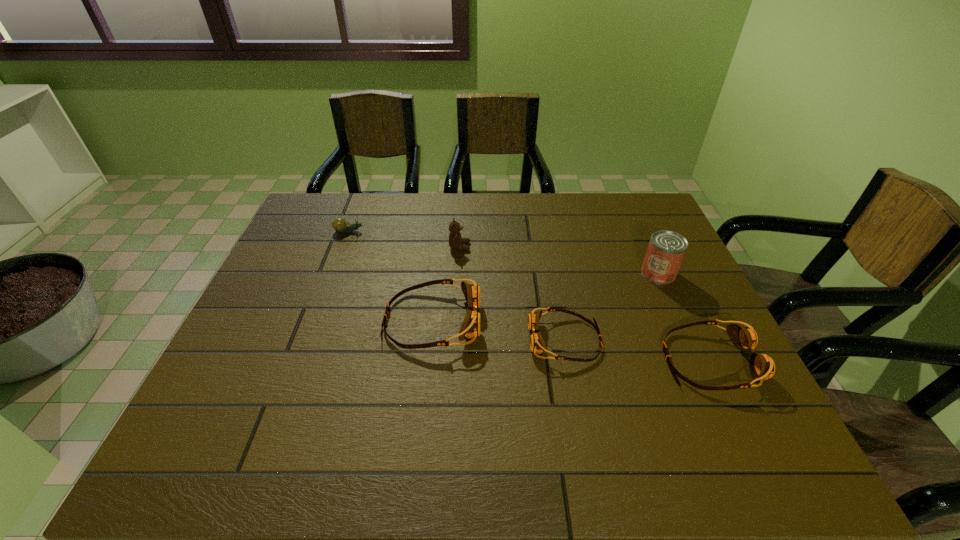
With all goggless evenly spaced, where should an extra goggles be placed on the left to continue the pattern? Please point out a vacant space. Please provide its 2D coordinates. Your answer should be formatted as a tuple, i.e. [(x, y)], where the tuple contains the x and y coordinates of a point satisfying the conditions above.

[(310, 302)]